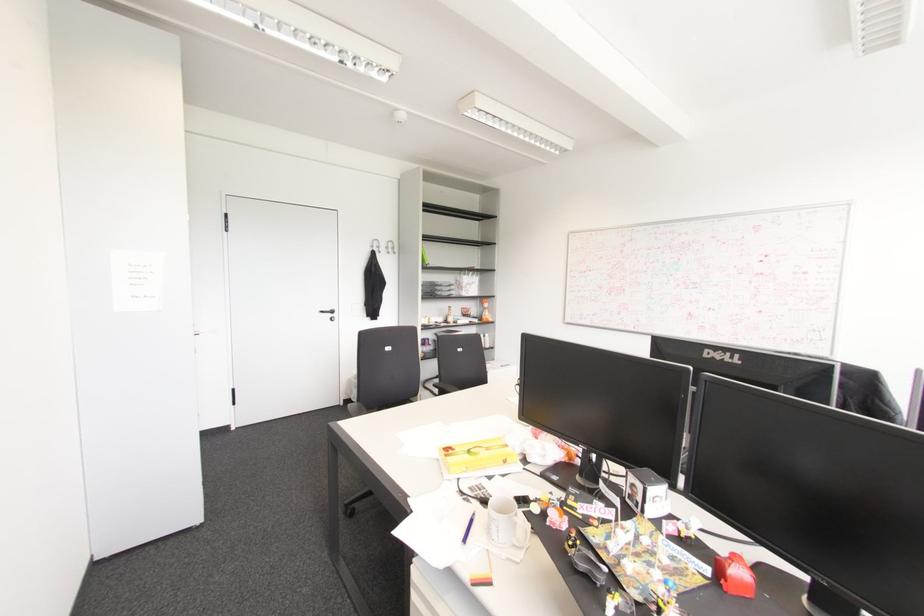
Find where to lift the small red toy. Please return your answer as a coordinate pair (x, y).

(735, 575)